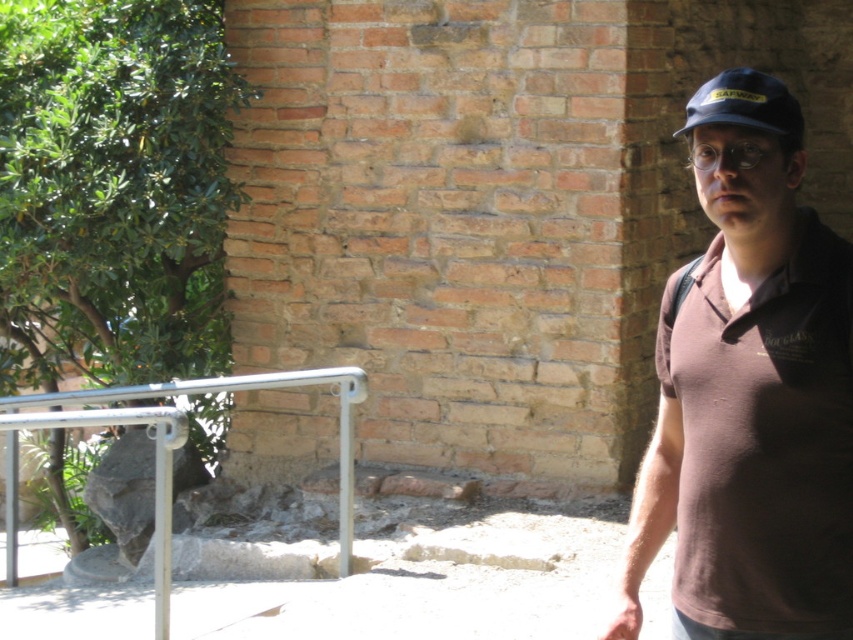
Question: Among these objects, which one is farthest from the camera?

Choices:
 (A) silver metallic rail at lower left
 (B) brown cotton shirt at right

Answer: (A)

Question: Can you confirm if silver metallic rail at lower left is bigger than blue fabric baseball cap at upper right?

Choices:
 (A) no
 (B) yes

Answer: (B)

Question: Considering the real-world distances, which object is farthest from the silver metallic rail at lower left?

Choices:
 (A) brown cotton shirt at right
 (B) blue fabric baseball cap at upper right

Answer: (B)

Question: Is silver metallic rail at lower left closer to camera compared to blue fabric baseball cap at upper right?

Choices:
 (A) no
 (B) yes

Answer: (A)

Question: Does silver metallic rail at lower left have a greater width compared to blue fabric baseball cap at upper right?

Choices:
 (A) no
 (B) yes

Answer: (B)

Question: Among these points, which one is farthest from the camera?

Choices:
 (A) (738, 74)
 (B) (726, 461)
 (C) (260, 374)

Answer: (C)